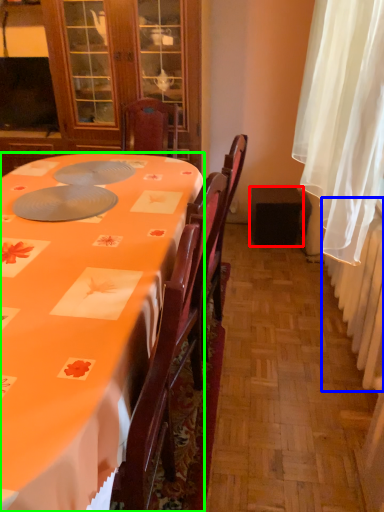
Question: Which object is the farthest from loudspeaker (highlighted by a red box)? Choose among these: radiator (highlighted by a blue box) or desk (highlighted by a green box).

Choices:
 (A) radiator
 (B) desk

Answer: (B)